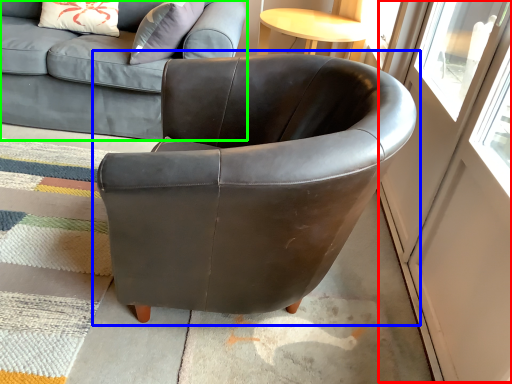
Question: Which is nearer to the screen door (highlighted by a red box)? chair (highlighted by a blue box) or studio couch (highlighted by a green box).

Choices:
 (A) chair
 (B) studio couch

Answer: (A)